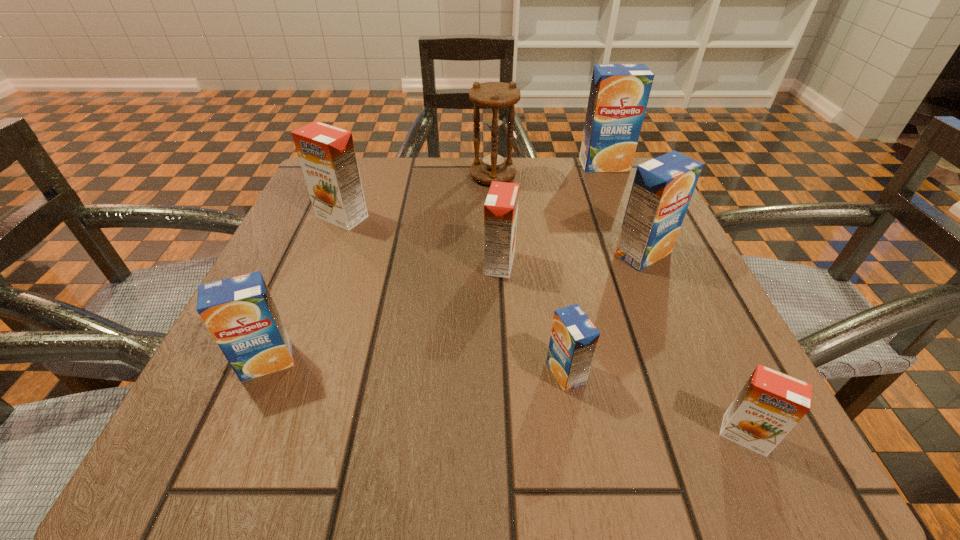
Locate an element on the screen. This screenshot has width=960, height=540. the third blue orange_juice from right to left is located at coordinates (574, 338).

This screenshot has width=960, height=540. I want to click on the smallest orange orange juice, so click(769, 405).

At what (x,y) coordinates should I click in order to perform the action: click on the nearest object. Please return your answer as a coordinate pair (x, y). The height and width of the screenshot is (540, 960). Looking at the image, I should click on (769, 405).

Locate an element on the screen. blank area located on the left of the farthest blue orange_juice is located at coordinates (556, 165).

Where is `vacant space positioned on the left of the hourglass`? vacant space positioned on the left of the hourglass is located at coordinates (373, 176).

This screenshot has height=540, width=960. I want to click on blank space located 0.150m on the front of the second farthest blue orange_juice, so tap(679, 339).

What are the coordinates of `free space located 0.220m on the front of the leftmost orange orange juice` in the screenshot? It's located at (303, 316).

Identify the location of free point located on the back of the second nearest orange orange juice. The height and width of the screenshot is (540, 960). (497, 221).

You are a GUI agent. You are given a task and a screenshot of the screen. Output one action in this format:
    pyautogui.click(x=<x>, y=<y>)
    Task: Click on the free space located 0.100m on the front of the third biggest blue orange_juice
    The image size is (960, 540).
    Given the screenshot: What is the action you would take?
    (x=228, y=453)

Find the location of a particular element. The width and height of the screenshot is (960, 540). vacant region located 0.150m on the back of the smallest blue orange_juice is located at coordinates (550, 283).